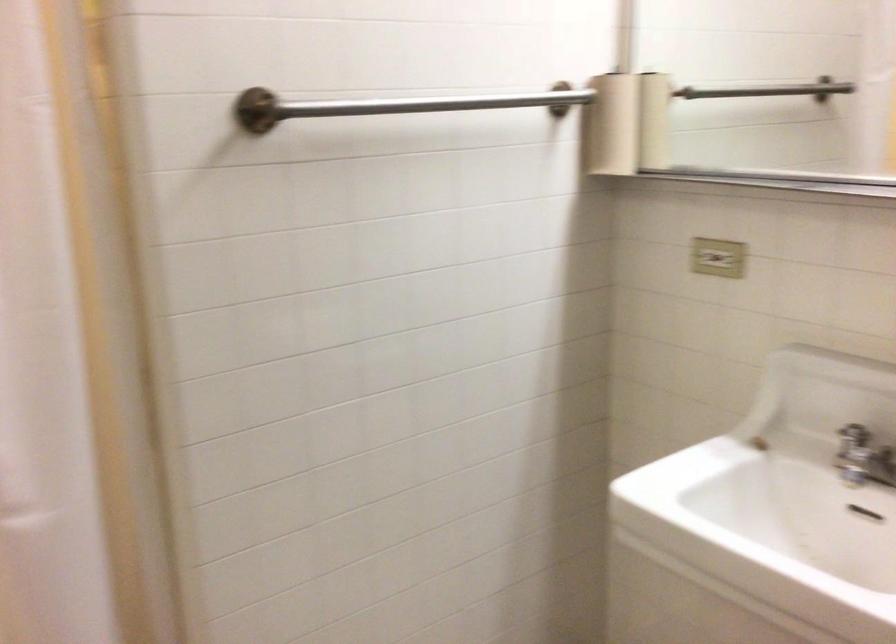
Describe the element at coordinates (857, 459) in the screenshot. The width and height of the screenshot is (896, 644). I see `a sink faucet handle` at that location.